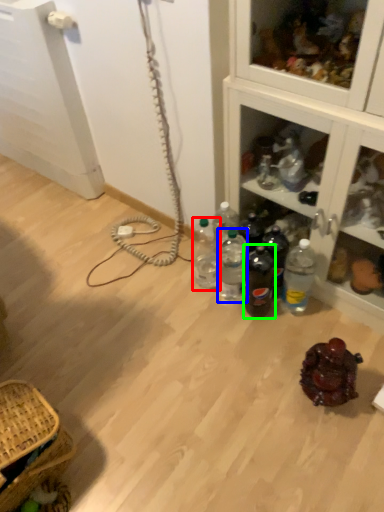
Question: Based on their relative distances, which object is farther from bottle (highlighted by a red box)? Choose from bottle (highlighted by a blue box) and bottle (highlighted by a green box).

Choices:
 (A) bottle
 (B) bottle

Answer: (B)